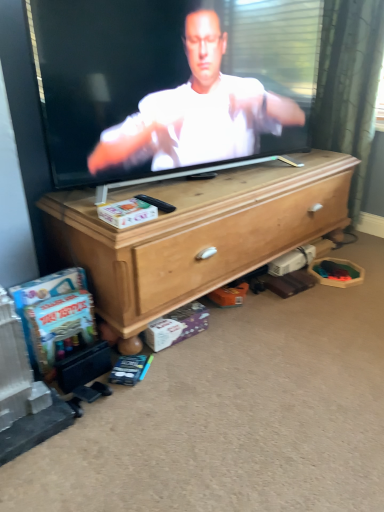
Locate an element on the screen. vacant area that lies to the right of black plastic remote control at center is located at coordinates (189, 201).